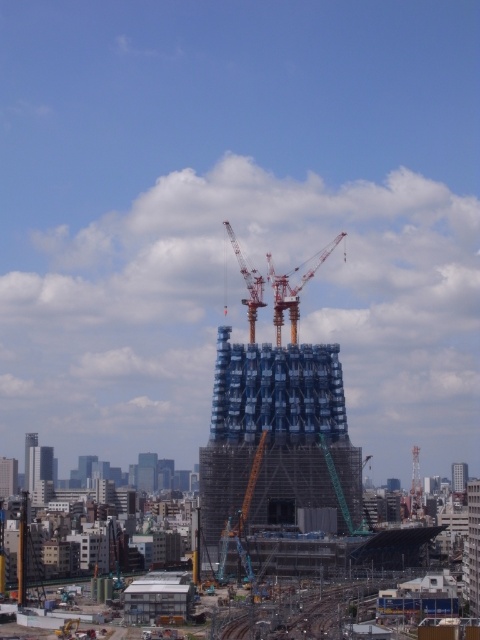
Question: Which point is farther to the camera?

Choices:
 (A) red metal crane at center
 (B) scaffolding metal structure at center

Answer: (A)

Question: Does red metal crane at center have a greater width compared to red metallic crane at center?

Choices:
 (A) no
 (B) yes

Answer: (B)

Question: From the image, what is the correct spatial relationship of red metal crane at center in relation to blue glass skyscraper at center?

Choices:
 (A) below
 (B) above

Answer: (B)

Question: Which is nearer to the red metal crane at center?

Choices:
 (A) metal train track at lower center
 (B) scaffolding metal structure at center
 (C) scaffolding metal tower at center
 (D) blue glass skyscraper at center

Answer: (C)

Question: Does metal train track at lower center have a smaller size compared to red metallic crane at center?

Choices:
 (A) no
 (B) yes

Answer: (B)

Question: Estimate the real-world distances between objects in this image. Which object is farther from the blue glass skyscraper at center?

Choices:
 (A) scaffolding metal structure at center
 (B) red metallic crane at center
 (C) scaffolding metal tower at center
 (D) red metal crane at center

Answer: (C)